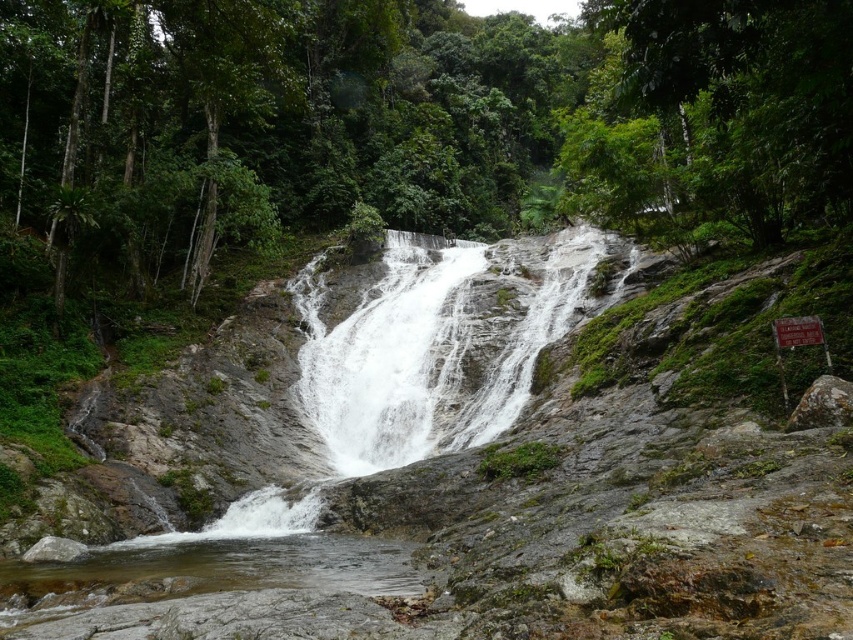
What are the coordinates of the white textured waterfall at center?

The white textured waterfall at center is located at point (408, 369).

You are a hiker who needs to cross a small stream in the forest. You see two rocks to step on, the gray rough rock at right and the gray smooth rock at lower left. Which rock is narrower and might be harder to step on?

The gray rough rock at right is thinner than the gray smooth rock at lower left, so it might be harder to step on due to its narrower width.

You are hiking near the waterfall and want to place a small potted plant between the gray rough rock at right and the gray smooth rock at lower left. Based on their positions, where should you place the plant to ensure it stays above the flowing water?

The gray rough rock at right is located above the gray smooth rock at lower left, so placing the plant between them near the gray rough rock at right would keep it above the flowing water.